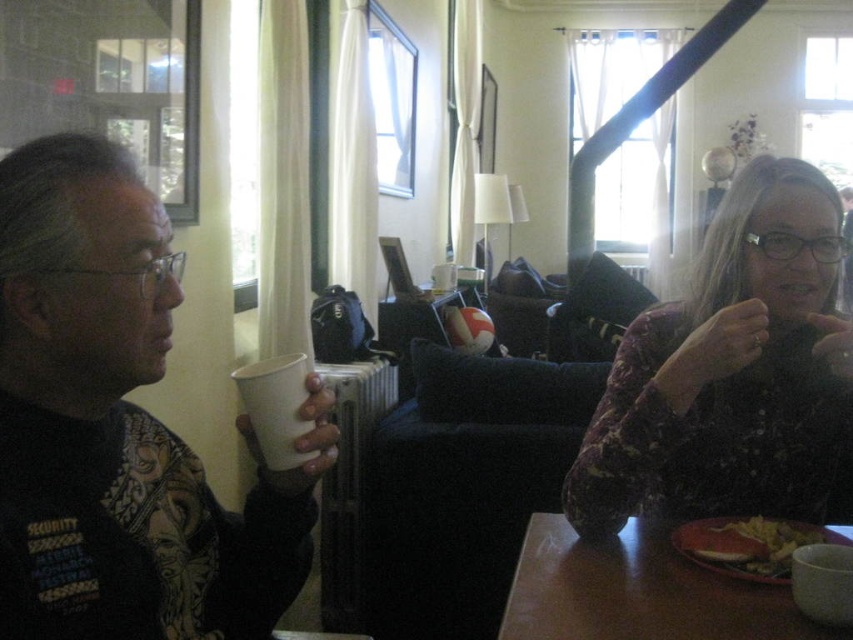
Question: Can you confirm if matte purple sweater at right is smaller than brown wooden table at lower right?

Choices:
 (A) no
 (B) yes

Answer: (A)

Question: Can you confirm if brown wooden table at lower right is smaller than matte plastic plate at lower right?

Choices:
 (A) yes
 (B) no

Answer: (B)

Question: Which point is closer to the camera taking this photo?

Choices:
 (A) (105, 163)
 (B) (589, 435)
 (C) (729, 550)

Answer: (A)

Question: Is white paper cup at left wider than brown wooden table at lower right?

Choices:
 (A) yes
 (B) no

Answer: (B)

Question: Which point is farther to the camera?

Choices:
 (A) matte plastic plate at lower right
 (B) white paper cup at left

Answer: (A)

Question: Which point is closer to the camera?

Choices:
 (A) (614, 560)
 (B) (801, 289)

Answer: (A)